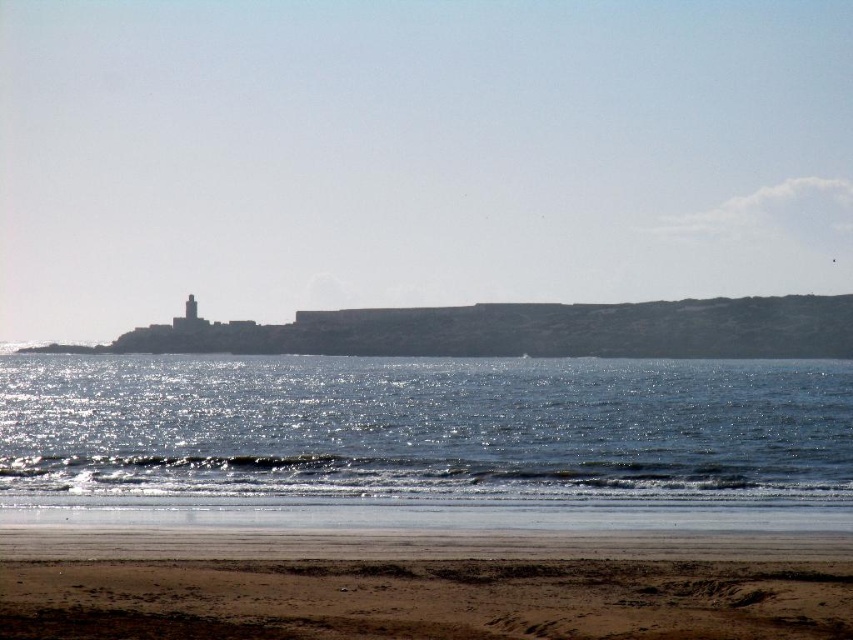
You are standing on the brown sandy beach at lower center and want to reach the glistening water at lower center. In which direction should you walk?

You should walk to the right because the glistening water at lower center is located to the right of the brown sandy beach at lower center.

You are a photographer planning to capture the entire scene of the glistening water at lower center and the brown sandy beach at lower center in one shot. Based on their sizes, which one will occupy more of the frame?

The glistening water at lower center has a larger size compared to the brown sandy beach at lower center, so it will occupy more of the frame.